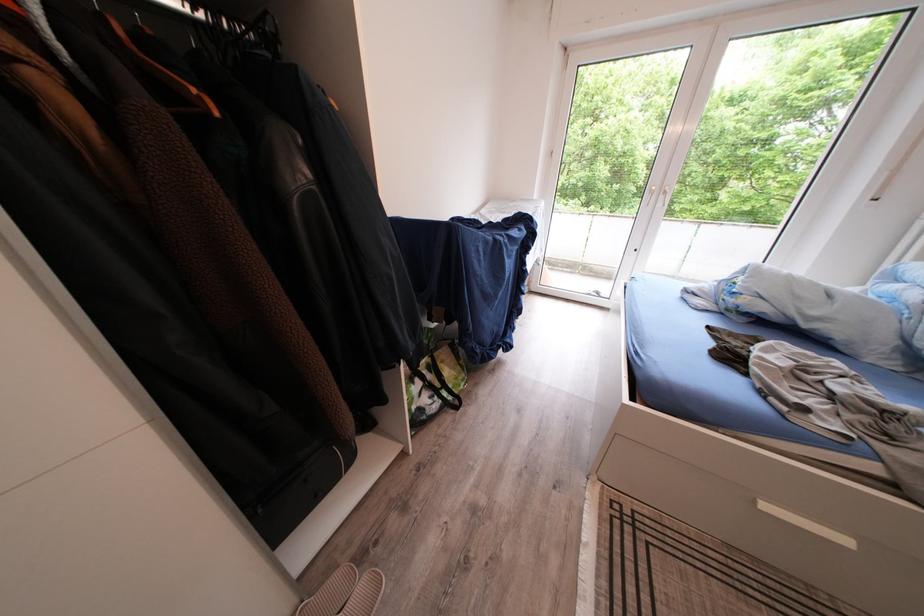
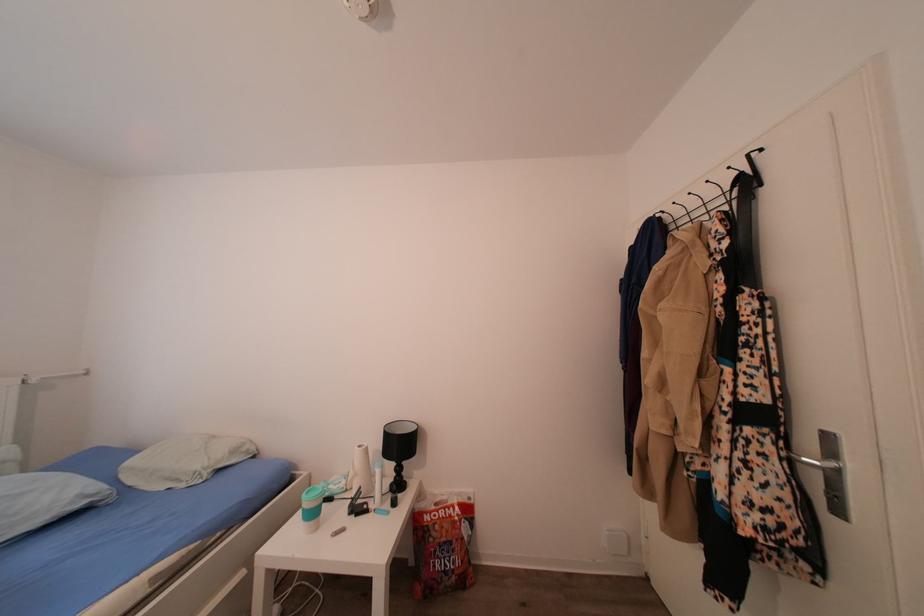
Question: How did the camera likely rotate?

Choices:
 (A) Left
 (B) Right
 (C) Up
 (D) Down

Answer: (B)